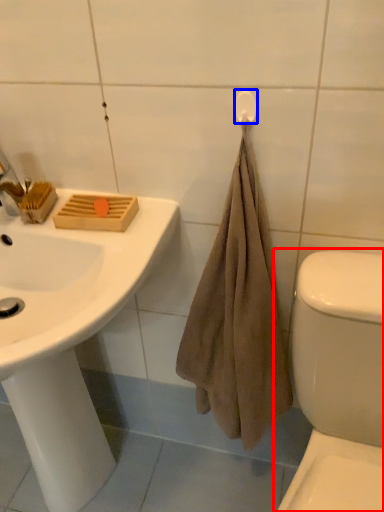
Question: Which of the following is the closest to the observer, toilet (highlighted by a red box) or towel bar (highlighted by a blue box)?

Choices:
 (A) toilet
 (B) towel bar

Answer: (A)